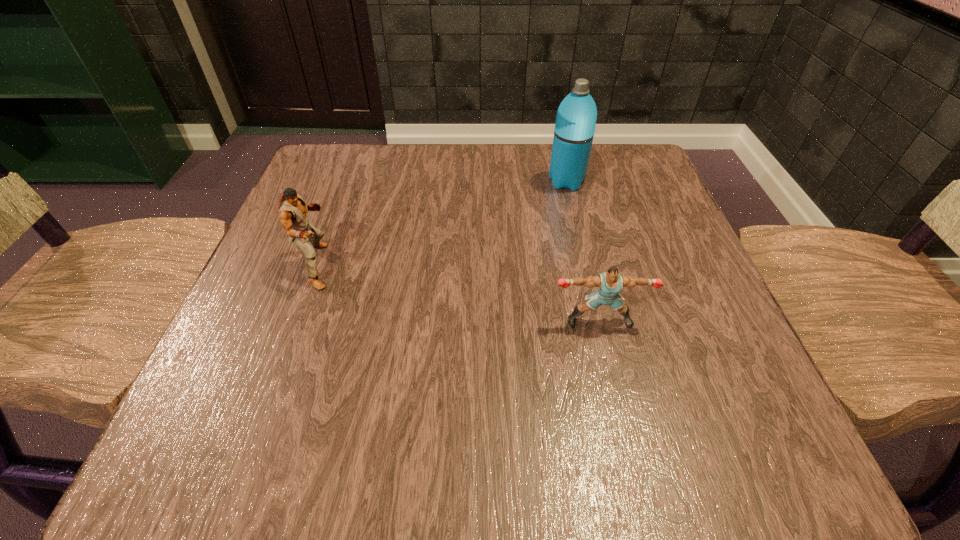
Find the location of a particular element. This screenshot has width=960, height=540. vacant area between the second tallest object and the nearer puncher is located at coordinates (459, 294).

Locate an element on the screen. object that stands as the second closest to the shorter puncher is located at coordinates (292, 209).

Select which object appears as the second closest to the taller puncher. Please provide its 2D coordinates. Your answer should be formatted as a tuple, i.e. [(x, y)], where the tuple contains the x and y coordinates of a point satisfying the conditions above.

[(574, 130)]

The width and height of the screenshot is (960, 540). I want to click on vacant space that satisfies the following two spatial constraints: 1. on the front side of the farthest object; 2. on the front-facing side of the taller puncher, so click(587, 266).